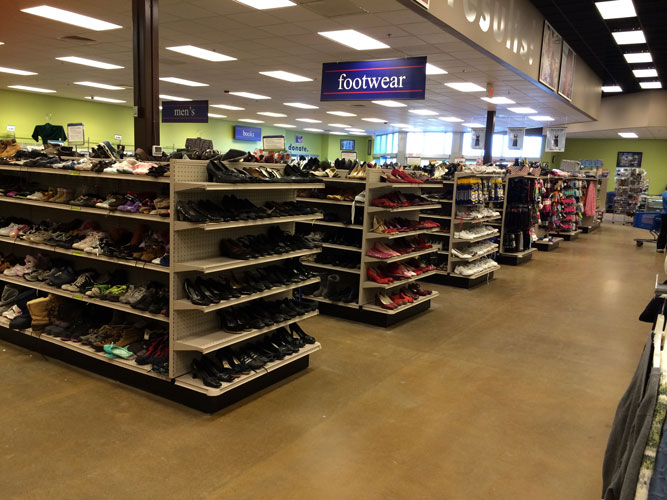
Identify the location of hanger. (654, 358).